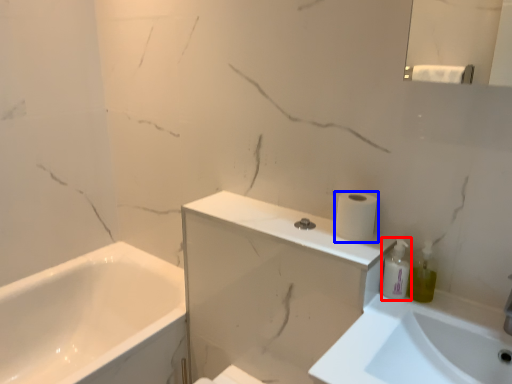
Question: Which object is further to the camera taking this photo, toiletry (highlighted by a red box) or toilet paper (highlighted by a blue box)?

Choices:
 (A) toiletry
 (B) toilet paper

Answer: (B)